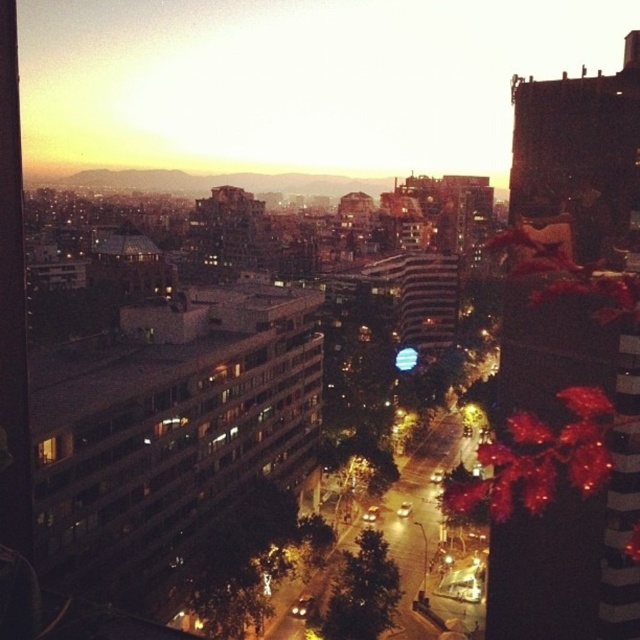
Measure the distance between matte glass window at upper center and shiny red leaves at right.

A distance of 903.50 feet exists between matte glass window at upper center and shiny red leaves at right.

Does matte glass window at upper center appear over shiny red leaves at right?

Yes, matte glass window at upper center is above shiny red leaves at right.

I want to click on matte glass window at upper center, so click(294, 81).

Consider the image. Which of these two, matte glass building at center-left or shiny red leaves at right, stands shorter?

With less height is shiny red leaves at right.

Does matte glass building at center-left appear on the left side of shiny red leaves at right?

Correct, you'll find matte glass building at center-left to the left of shiny red leaves at right.

Between point (125, 348) and point (576, 484), which one is positioned in front?

Point (576, 484)

The image size is (640, 640). I want to click on matte glass building at center-left, so (x=163, y=445).

Is matte glass window at upper center to the right of matte glass building at center-left from the viewer's perspective?

Indeed, matte glass window at upper center is positioned on the right side of matte glass building at center-left.

Which is above, matte glass window at upper center or matte glass building at center-left?

Positioned higher is matte glass window at upper center.

Is point (285, 161) farther from viewer compared to point (136, 570)?

Yes, point (285, 161) is behind point (136, 570).

What are the coordinates of `matte glass window at upper center` in the screenshot? It's located at (294, 81).